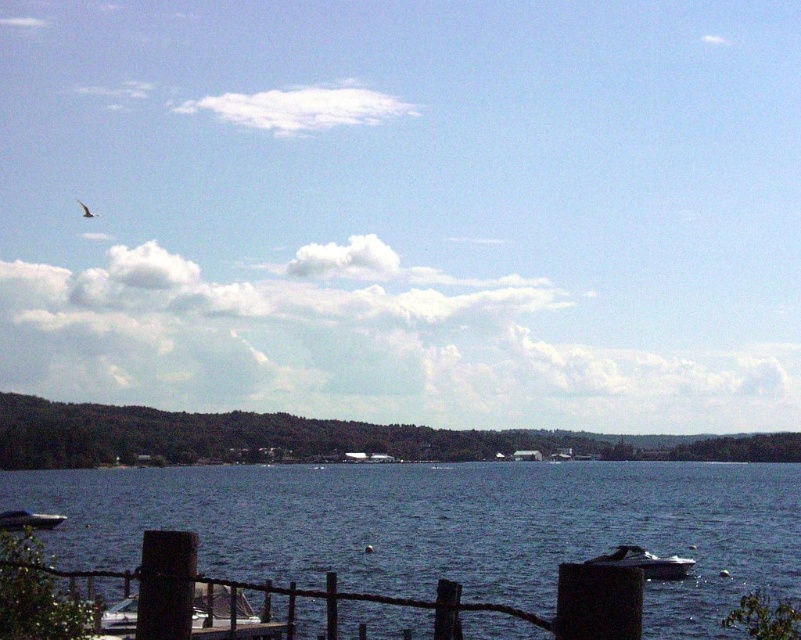
Who is more forward, (687, 561) or (45, 515)?

Point (687, 561) is more forward.

The height and width of the screenshot is (640, 801). What do you see at coordinates (645, 563) in the screenshot?
I see `shiny silver boat at lower right` at bounding box center [645, 563].

Which is in front, point (643, 552) or point (39, 528)?

Point (643, 552) is in front.

At what (x,y) coordinates should I click in order to perform the action: click on shiny silver boat at lower right. Please return your answer as a coordinate pair (x, y). Looking at the image, I should click on (645, 563).

Does shiny silver boat at lower right have a greater width compared to smooth gray bird at upper left?

Incorrect, shiny silver boat at lower right's width does not surpass smooth gray bird at upper left's.

Does shiny silver boat at lower right come behind smooth gray bird at upper left?

No, shiny silver boat at lower right is closer to the viewer.

Is point (610, 564) positioned before point (95, 214)?

Yes, it is in front of point (95, 214).

Find the location of a particular element. shiny silver boat at lower right is located at coordinates (645, 563).

Is blue water at center in front of smooth gray bird at upper left?

Yes.

Between blue water at center and smooth gray bird at upper left, which one is positioned lower?

blue water at center is lower down.

Between point (276, 605) and point (91, 212), which one is positioned in front?

Point (276, 605)

Identify the location of blue water at center. (445, 525).